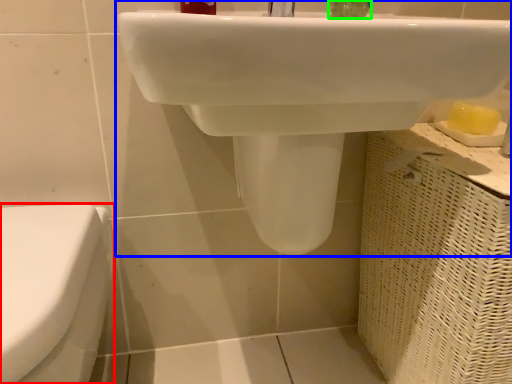
Question: Which is farther away from toilet (highlighted by a red box)? sink (highlighted by a blue box) or liquid (highlighted by a green box)?

Choices:
 (A) sink
 (B) liquid

Answer: (B)